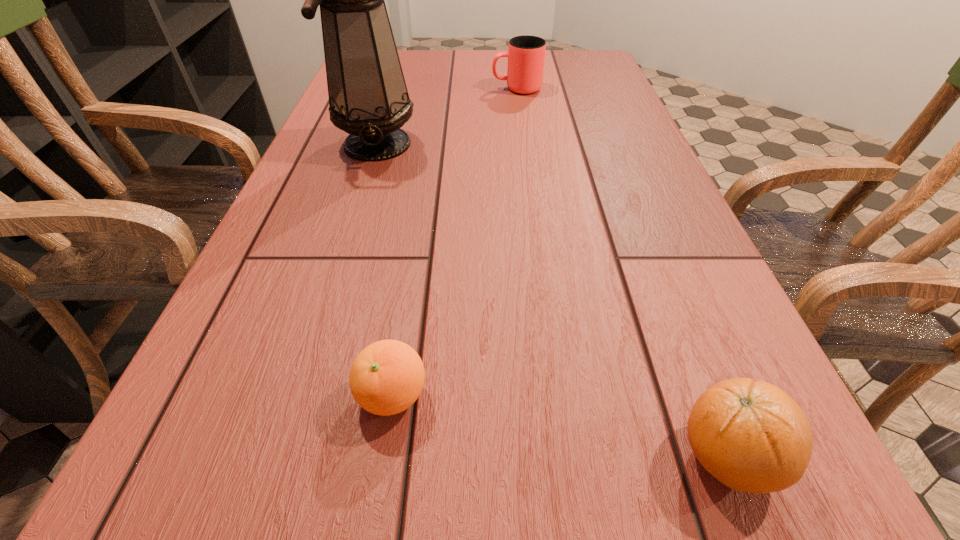
This screenshot has height=540, width=960. I want to click on vacant space located on the handle side of the cup, so click(379, 89).

I want to click on free space located 0.350m on the handle side of the cup, so click(x=364, y=89).

Where is `vacant space located 0.080m on the back of the right orange`? This screenshot has width=960, height=540. vacant space located 0.080m on the back of the right orange is located at coordinates (688, 356).

Locate an element on the screen. This screenshot has height=540, width=960. free space located 0.190m on the right of the left orange is located at coordinates (576, 395).

Find the location of a particular element. object that is at the left edge is located at coordinates (368, 98).

Locate an element on the screen. The image size is (960, 540). object that is at the right edge is located at coordinates (750, 435).

The image size is (960, 540). In the image, there is a desktop. In order to click on vacant space at the far edge in this screenshot , I will do `click(471, 70)`.

Find the location of a particular element. Image resolution: width=960 pixels, height=540 pixels. free space at the left edge of the desktop is located at coordinates (204, 439).

This screenshot has width=960, height=540. I want to click on free space at the right edge of the desktop, so click(676, 305).

I want to click on vacant region at the far right corner, so click(x=557, y=67).